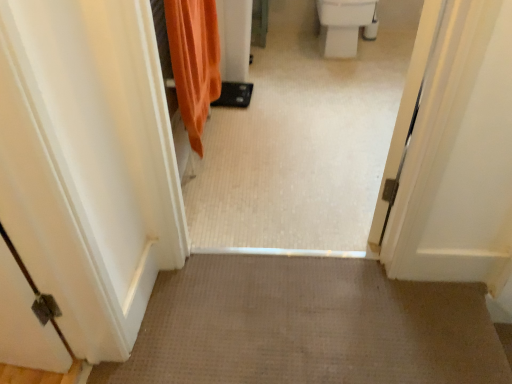
Question: Could white glossy toilet bowl at upper right be considered to be inside orange fabric shower curtain at upper left?

Choices:
 (A) yes
 (B) no

Answer: (B)

Question: Is orange fabric shower curtain at upper left smaller than white glossy toilet bowl at upper right?

Choices:
 (A) yes
 (B) no

Answer: (A)

Question: From the image's perspective, would you say orange fabric shower curtain at upper left is positioned over white glossy toilet bowl at upper right?

Choices:
 (A) no
 (B) yes

Answer: (A)

Question: Does orange fabric shower curtain at upper left come behind white glossy toilet bowl at upper right?

Choices:
 (A) yes
 (B) no

Answer: (B)

Question: Is orange fabric shower curtain at upper left facing towards white glossy toilet bowl at upper right?

Choices:
 (A) yes
 (B) no

Answer: (B)

Question: Is point (355, 11) closer or farther from the camera than point (328, 173)?

Choices:
 (A) farther
 (B) closer

Answer: (A)

Question: Visually, is white glossy toilet bowl at upper right positioned to the left or to the right of white glossy tile floor at center?

Choices:
 (A) left
 (B) right

Answer: (B)

Question: Is white glossy toilet bowl at upper right situated inside white glossy tile floor at center or outside?

Choices:
 (A) outside
 (B) inside

Answer: (A)

Question: In the image, is white glossy toilet bowl at upper right positioned in front of or behind white glossy tile floor at center?

Choices:
 (A) behind
 (B) front

Answer: (A)

Question: Is white glossy tile floor at center wider or thinner than orange fabric shower curtain at upper left?

Choices:
 (A) thin
 (B) wide

Answer: (B)

Question: Is point (380, 19) positioned closer to the camera than point (210, 46)?

Choices:
 (A) farther
 (B) closer

Answer: (A)

Question: From a real-world perspective, relative to orange fabric shower curtain at upper left, is white glossy tile floor at center vertically above or below?

Choices:
 (A) above
 (B) below

Answer: (A)

Question: In terms of size, does white glossy tile floor at center appear bigger or smaller than orange fabric shower curtain at upper left?

Choices:
 (A) small
 (B) big

Answer: (B)

Question: In terms of width, does white glossy tile floor at center look wider or thinner when compared to white glossy toilet bowl at upper right?

Choices:
 (A) thin
 (B) wide

Answer: (A)

Question: From the image's perspective, is white glossy tile floor at center positioned above or below white glossy toilet bowl at upper right?

Choices:
 (A) below
 (B) above

Answer: (A)